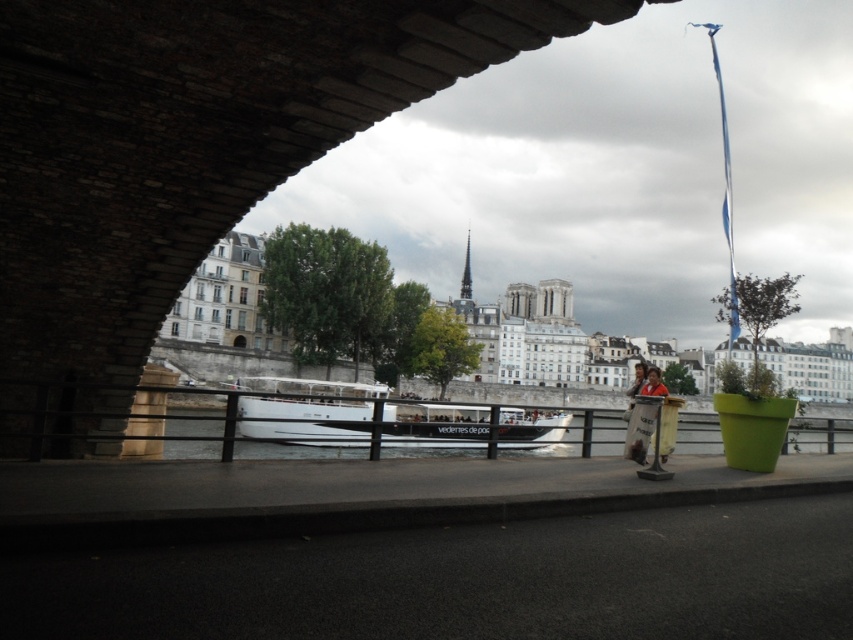
You are standing under the dark gray stone bridge at upper left and want to see the white glossy boat at center. In which direction should you look relative to your position?

You should look to the right because the dark gray stone bridge at upper left is to the left of the white glossy boat at center, so the boat is to your right side.

You are standing at the stone archway and want to point out two specific points in the scene. The first point is located at coordinates point (x=44, y=328) and the second at point (x=329, y=401). Which of these two points is nearer to you?

Point (x=44, y=328) is closer to the viewer than point (x=329, y=401).